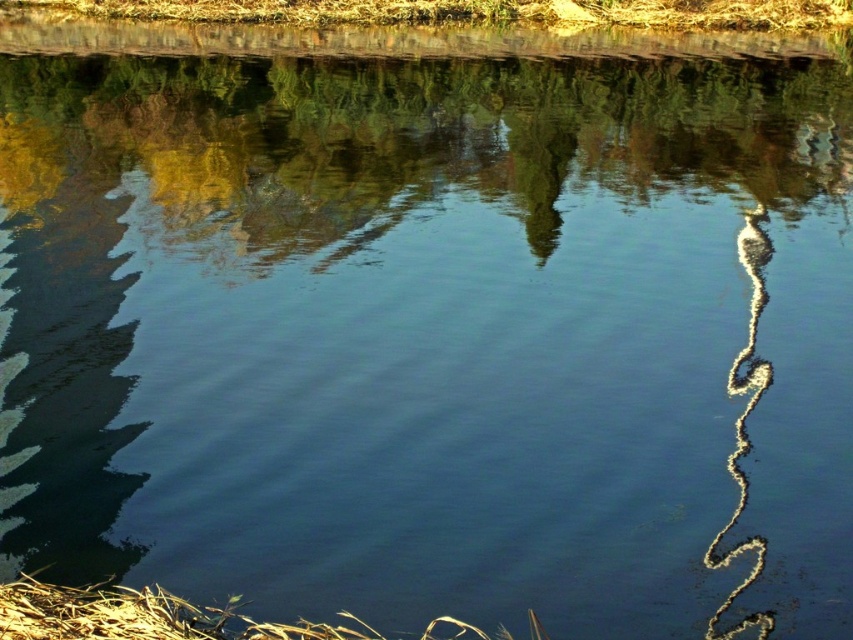
Question: Which point is closer to the camera?

Choices:
 (A) smooth water at center
 (B) brown grass at lower left

Answer: (B)

Question: Is smooth water at center wider than brown grass at lower left?

Choices:
 (A) yes
 (B) no

Answer: (A)

Question: Considering the relative positions of smooth water at center and brown grass at lower left in the image provided, where is smooth water at center located with respect to brown grass at lower left?

Choices:
 (A) above
 (B) below

Answer: (A)

Question: Which point is farther from the camera taking this photo?

Choices:
 (A) (7, 614)
 (B) (747, 125)

Answer: (B)

Question: Is smooth water at center thinner than brown grass at lower left?

Choices:
 (A) yes
 (B) no

Answer: (B)